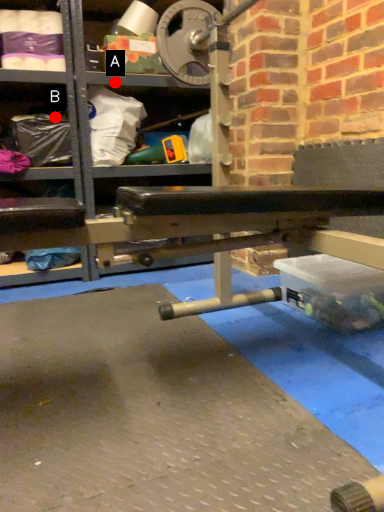
Question: Two points are circled on the image, labeled by A and B beside each circle. Which point is closer to the camera?

Choices:
 (A) A is closer
 (B) B is closer

Answer: (A)